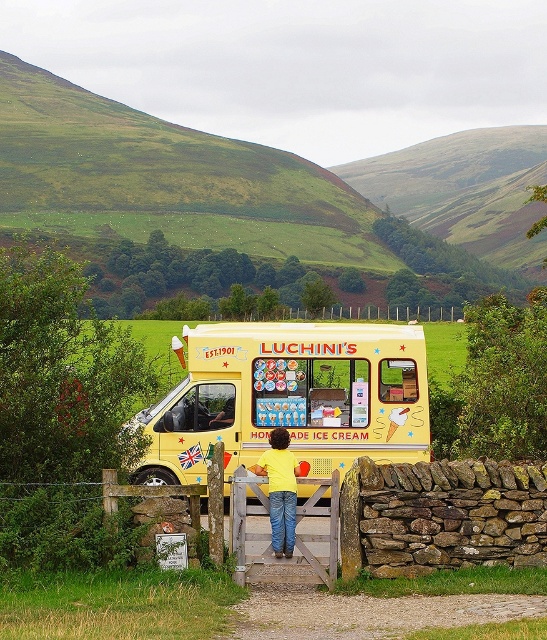
Question: Is green grassy hillside at upper left positioned behind yellow matte shirt at center?

Choices:
 (A) no
 (B) yes

Answer: (B)

Question: Which is farther from the green grassy hillside at upper left?

Choices:
 (A) yellow matte ice cream van at center
 (B) yellow matte shirt at center
 (C) wooden gate at center

Answer: (B)

Question: Which of the following is the farthest from the observer?

Choices:
 (A) (395, 305)
 (B) (34, 106)
 (C) (290, 545)

Answer: (B)

Question: Which point is closer to the camera taking this photo?

Choices:
 (A) (272, 429)
 (B) (344, 390)

Answer: (A)

Question: Considering the relative positions of green grassy hillside at upper left and wooden gate at center in the image provided, where is green grassy hillside at upper left located with respect to wooden gate at center?

Choices:
 (A) above
 (B) below

Answer: (A)

Question: Considering the relative positions of yellow matte shirt at center and wooden gate at center in the image provided, where is yellow matte shirt at center located with respect to wooden gate at center?

Choices:
 (A) below
 (B) above

Answer: (A)